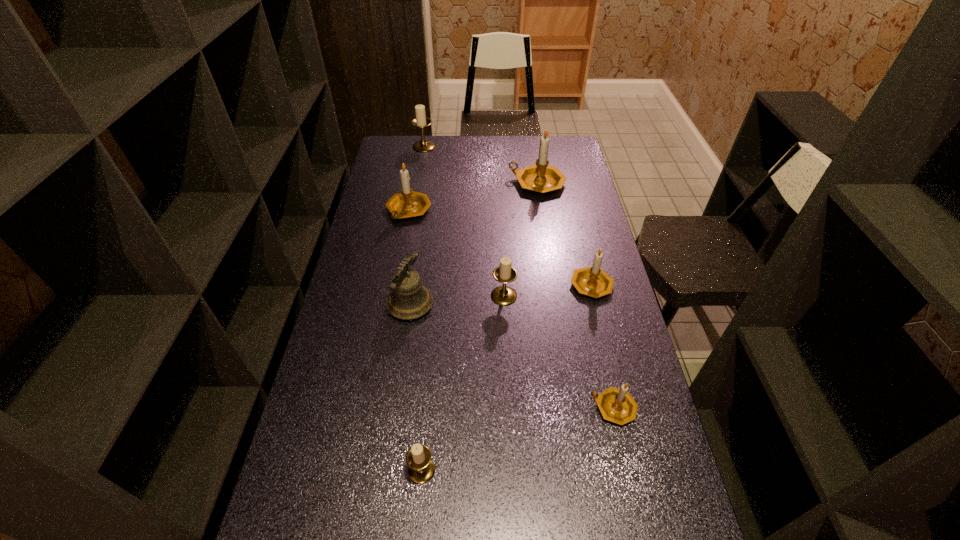
The width and height of the screenshot is (960, 540). In order to click on free spot between the leftmost white candle holder and the leftmost gold candle holder in this screenshot , I will do `click(417, 179)`.

At what (x,y) coordinates should I click in order to perform the action: click on free spot between the second nearest object and the second white candle holder from right to left. Please return your answer as a coordinate pair (x, y). The width and height of the screenshot is (960, 540). Looking at the image, I should click on (517, 439).

Where is `blank region between the farthest white candle holder and the bell`? The image size is (960, 540). blank region between the farthest white candle holder and the bell is located at coordinates 418,226.

Where is `vacant point located between the biggest gold candle holder and the fourth object from right to left`? The height and width of the screenshot is (540, 960). vacant point located between the biggest gold candle holder and the fourth object from right to left is located at coordinates (520, 240).

This screenshot has width=960, height=540. Find the location of `empty location between the farthest object and the second biggest white candle holder`. empty location between the farthest object and the second biggest white candle holder is located at coordinates (464, 221).

Locate which object is the seventh closest to the third farthest gold candle holder. Please provide its 2D coordinates. Your answer should be formatted as a tuple, i.e. [(x, y)], where the tuple contains the x and y coordinates of a point satisfying the conditions above.

[(421, 120)]

Locate an element on the screen. Image resolution: width=960 pixels, height=540 pixels. object that is the closest to the farthest candle holder is located at coordinates (408, 203).

Identify which candle holder is the fifth nearest to the biggest gold candle holder. Please provide its 2D coordinates. Your answer should be formatted as a tuple, i.e. [(x, y)], where the tuple contains the x and y coordinates of a point satisfying the conditions above.

[(616, 405)]

You are a GUI agent. You are given a task and a screenshot of the screen. Output one action in this format:
    pyautogui.click(x=<x>, y=<y>)
    Task: Click on the candle holder that stands as the fourth closest to the smallest gold candle holder
    This screenshot has width=960, height=540.
    Given the screenshot: What is the action you would take?
    pyautogui.click(x=408, y=203)

Select which gold candle holder appears as the fourth closest to the smallest white candle holder. Please provide its 2D coordinates. Your answer should be formatted as a tuple, i.e. [(x, y)], where the tuple contains the x and y coordinates of a point satisfying the conditions above.

[(540, 177)]